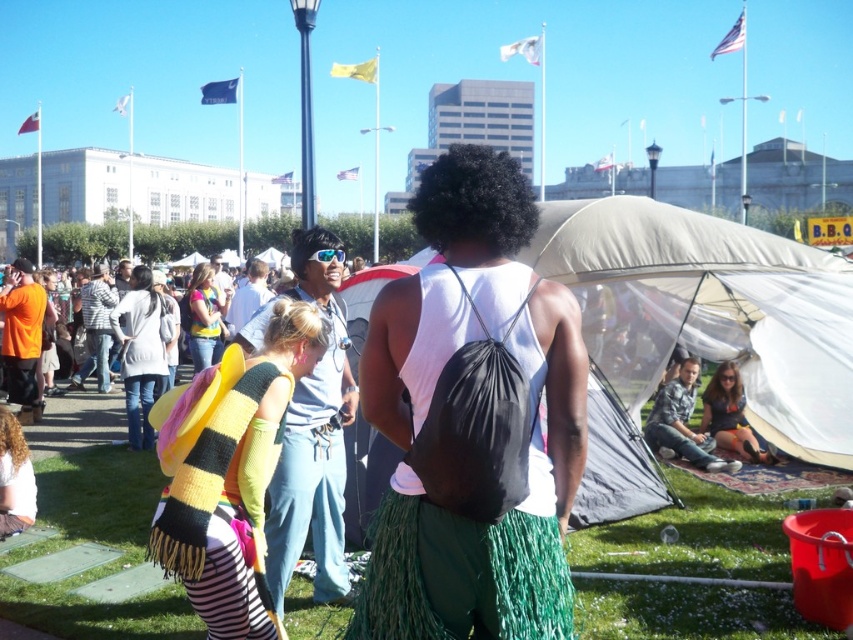
Who is positioned more to the right, green fringed skirt at lower center or black matte afro at center?

Positioned to the right is green fringed skirt at lower center.

Which of these two, green fringed skirt at lower center or black matte afro at center, stands shorter?

green fringed skirt at lower center is shorter.

Between point (628, 561) and point (299, 268), which one is positioned behind?

Positioned behind is point (628, 561).

Locate an element on the screen. The image size is (853, 640). green fringed skirt at lower center is located at coordinates pyautogui.click(x=97, y=541).

Between point (717, 532) and point (125, 353), which one is positioned in front?

Positioned in front is point (717, 532).

Image resolution: width=853 pixels, height=640 pixels. I want to click on green fringed skirt at lower center, so click(x=97, y=541).

In the scene shown: Between knitted scarf at lower left and blonde hair at center, which one appears on the left side from the viewer's perspective?

From the viewer's perspective, knitted scarf at lower left appears more on the left side.

Is knitted scarf at lower left below blonde hair at center?

Indeed, knitted scarf at lower left is positioned under blonde hair at center.

Is point (21, 497) positioned after point (296, 300)?

That is True.

This screenshot has height=640, width=853. I want to click on knitted scarf at lower left, so click(x=15, y=477).